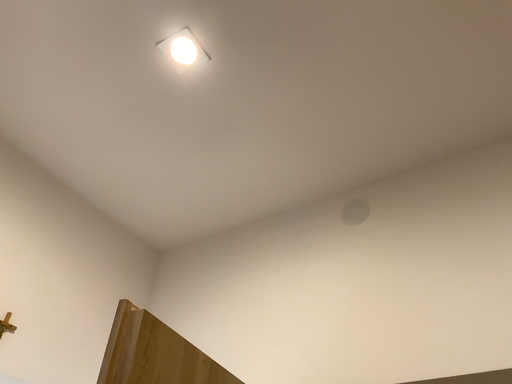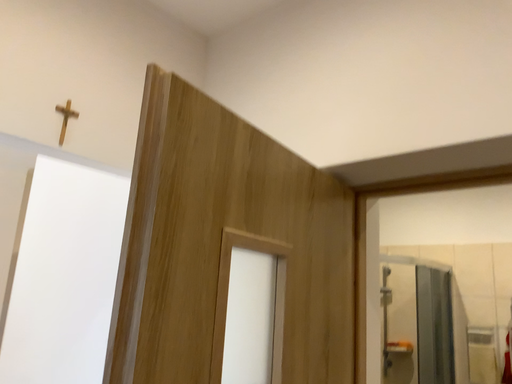
Question: How did the camera likely rotate when shooting the video?

Choices:
 (A) rotated left
 (B) rotated right

Answer: (A)